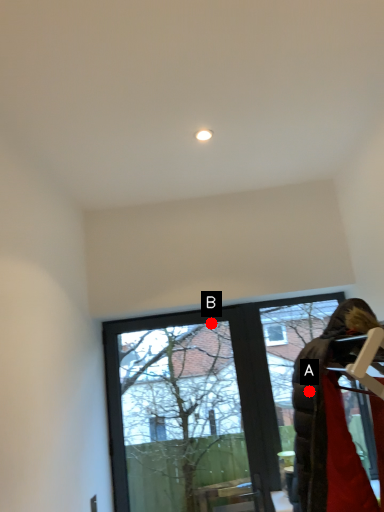
Question: Two points are circled on the image, labeled by A and B beside each circle. Which of the following is the farthest from the observer?

Choices:
 (A) A is further
 (B) B is further

Answer: (B)